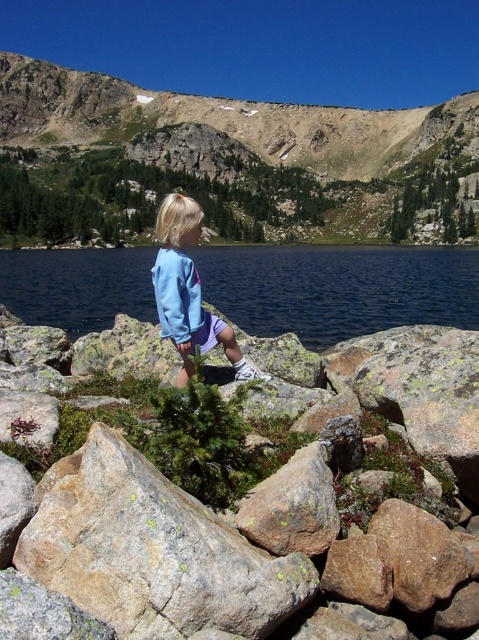
Is brown rough rock at center above light blue fleece jacket at center?

Incorrect, brown rough rock at center is not positioned above light blue fleece jacket at center.

Does brown rough rock at center come in front of light blue fleece jacket at center?

Yes, it is.

Who is more distant from viewer, (467, 538) or (162, 272)?

The point (162, 272) is behind.

Locate an element on the screen. brown rough rock at center is located at coordinates (243, 496).

How much distance is there between rugged brown rock at upper center and blue fabric lake at center?

rugged brown rock at upper center is 49.58 meters from blue fabric lake at center.

Which of these two, rugged brown rock at upper center or blue fabric lake at center, stands shorter?

Standing shorter between the two is blue fabric lake at center.

Find the location of a particular element. The image size is (479, 640). rugged brown rock at upper center is located at coordinates (227, 163).

Which of these two, brown rough rock at center or blue fabric lake at center, stands taller?

Standing taller between the two is blue fabric lake at center.

Describe the element at coordinates (243, 496) in the screenshot. I see `brown rough rock at center` at that location.

Image resolution: width=479 pixels, height=640 pixels. I want to click on brown rough rock at center, so click(x=243, y=496).